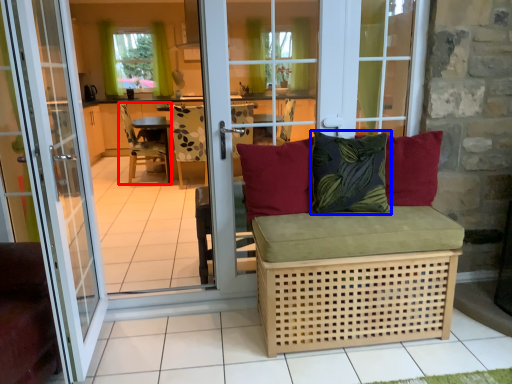
Question: Which point is further to the camera, chair (highlighted by a red box) or pillow (highlighted by a blue box)?

Choices:
 (A) chair
 (B) pillow

Answer: (A)